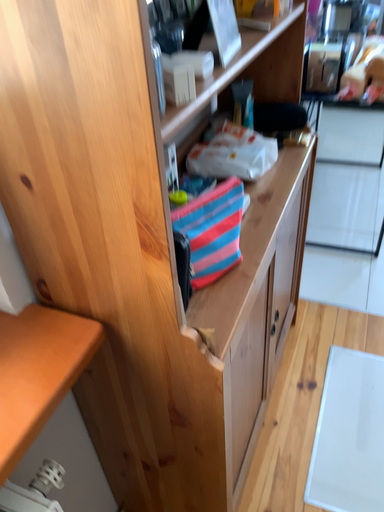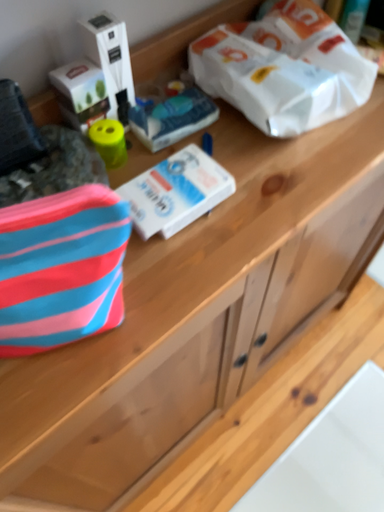
Question: Which way did the camera rotate in the video?

Choices:
 (A) rotated upward
 (B) rotated downward

Answer: (B)